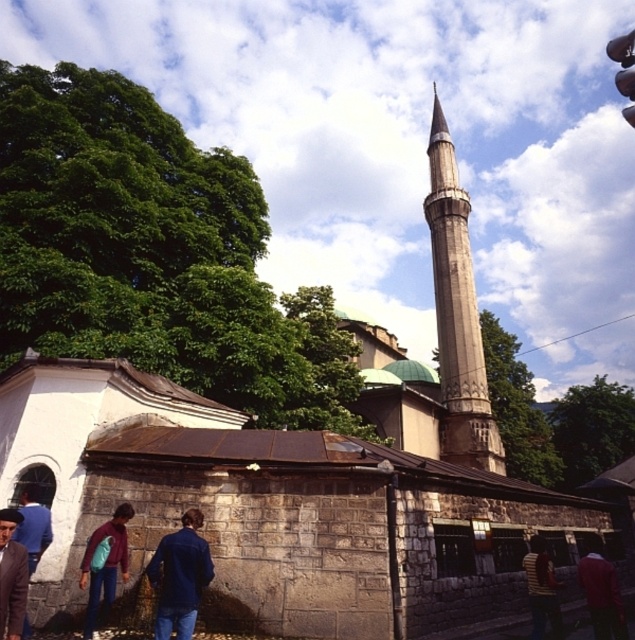
You are standing in front of the mosque and notice both the smooth stone minaret at center and the blue denim jacket at lower center. Which object is located to the right of the other?

The smooth stone minaret at center is positioned on the right side of blue denim jacket at lower center.